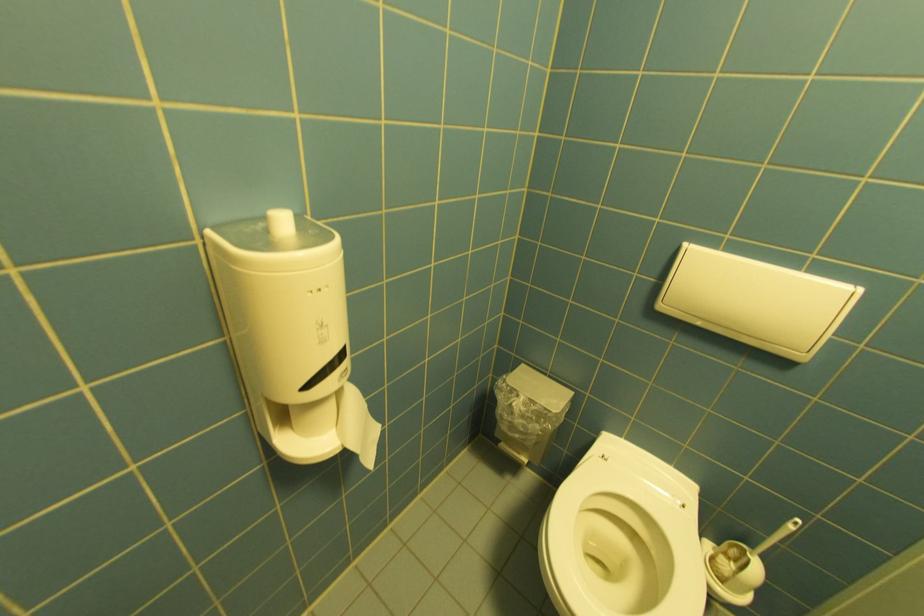
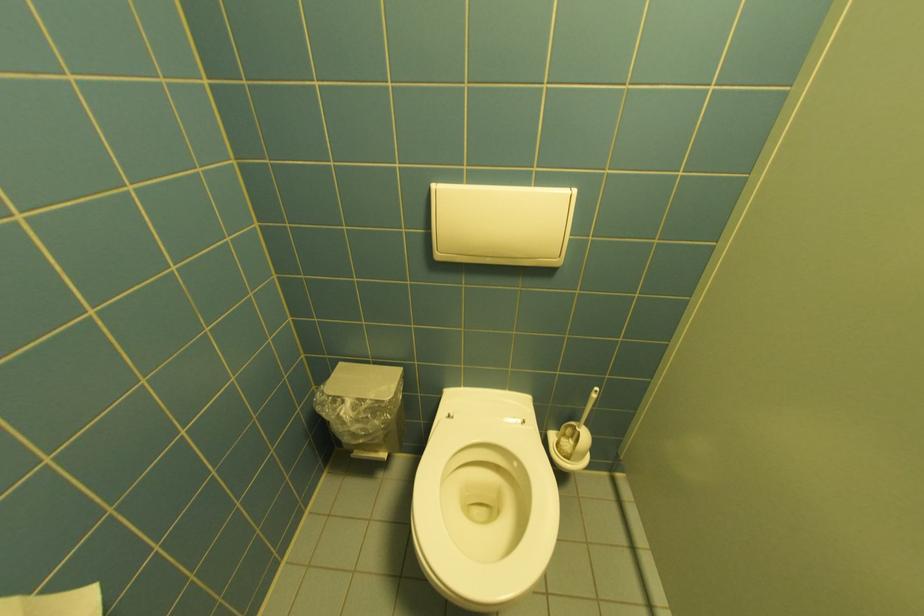
In the second image, find the point that corresponds to point 690,507 in the first image.

(529, 424)